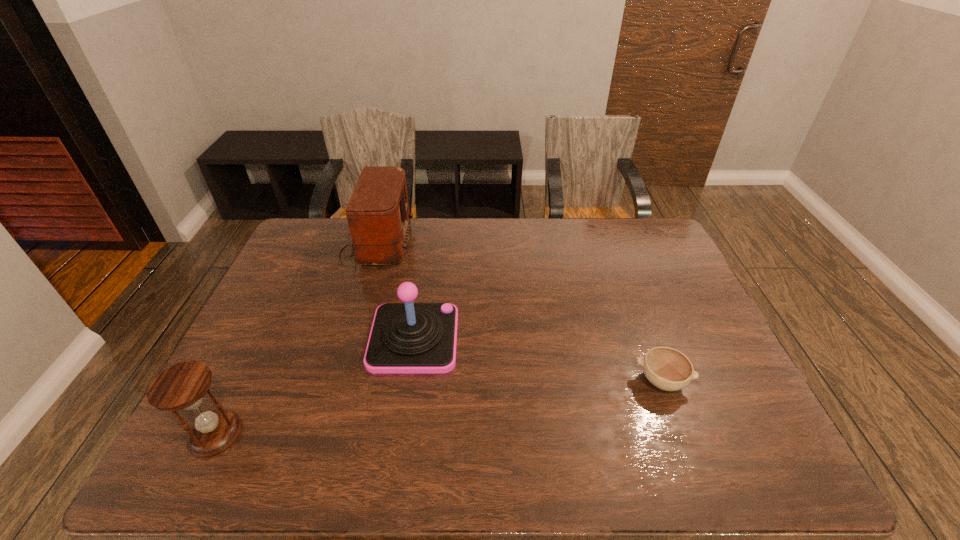
Locate an element on the screen. This screenshot has width=960, height=540. the farthest object is located at coordinates (378, 215).

Locate an element on the screen. joystick is located at coordinates (406, 338).

The height and width of the screenshot is (540, 960). Find the location of `hourglass`. hourglass is located at coordinates (182, 386).

At what (x,y) coordinates should I click in order to perform the action: click on the leftmost object. Please return your answer as a coordinate pair (x, y). The image size is (960, 540). Looking at the image, I should click on (182, 386).

Where is `the shortest object`? This screenshot has width=960, height=540. the shortest object is located at coordinates (668, 369).

Identify the location of the rightmost object. (668, 369).

I want to click on vacant space located on the front panel of the radio receiver, so coord(464,242).

Identify the location of blank area located 0.050m forward from the base of the joystick. (475, 339).

Image resolution: width=960 pixels, height=540 pixels. What are the coordinates of `vacant space located 0.240m on the right of the hourglass` in the screenshot? It's located at (348, 434).

Find the location of `vacant space located 0.370m on the left of the rightmost object`. vacant space located 0.370m on the left of the rightmost object is located at coordinates (487, 381).